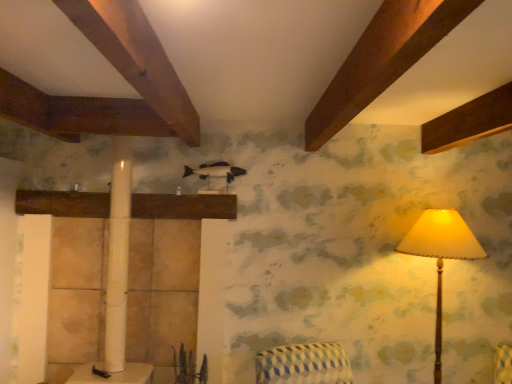
Identify the location of matte cream lampshade at right. The height and width of the screenshot is (384, 512). (441, 255).

Describe the element at coordinates (441, 255) in the screenshot. The image size is (512, 384). I see `matte cream lampshade at right` at that location.

Identify the location of matte cream lampshade at right. (441, 255).